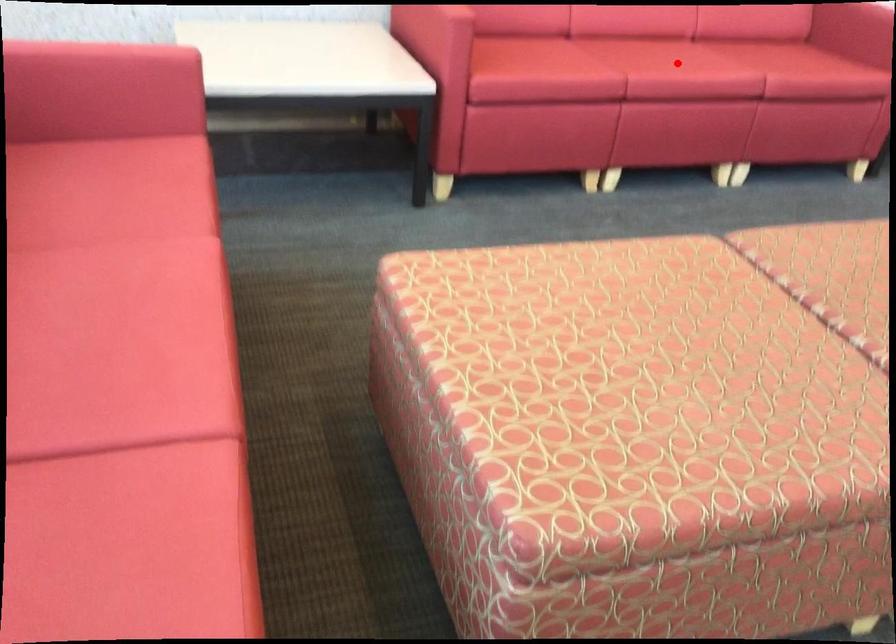
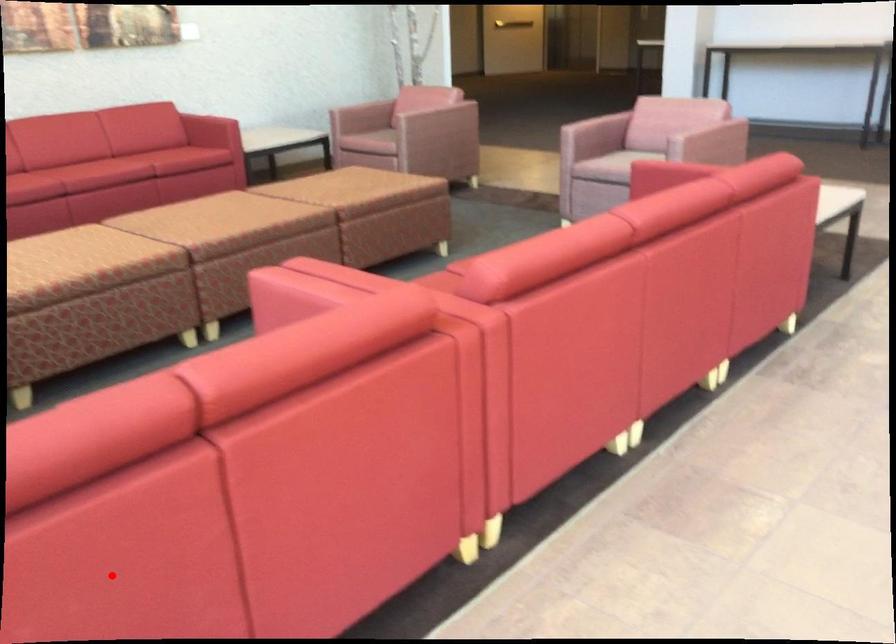
I am providing you with two images of the same scene from different viewpoints. A red point is marked on the first image and another point is marked on the second image. Does the point marked in image1 correspond to the same location as the one in image2?

No